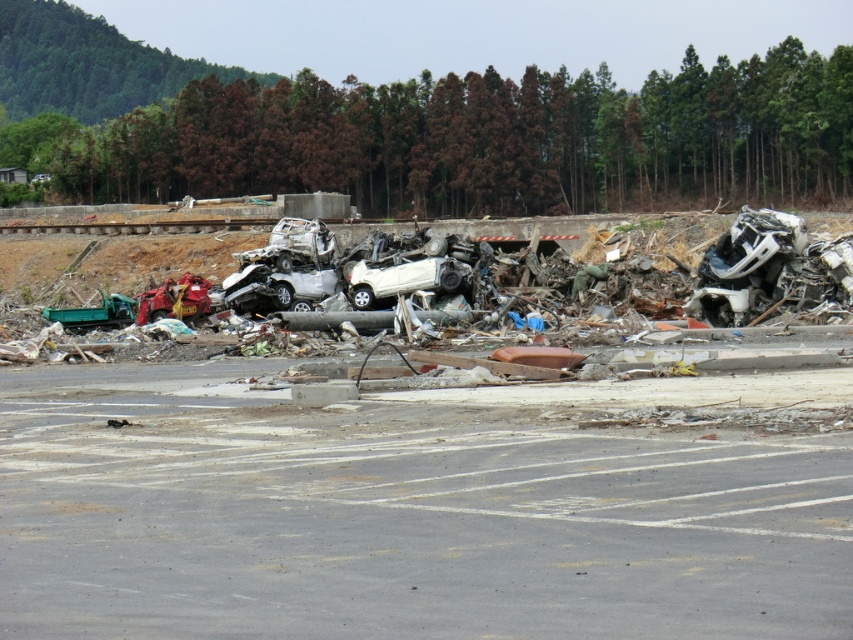
Question: Which object is farther from the camera taking this photo?

Choices:
 (A) gray asphalt parking lot at lower center
 (B) metallic red motorcycle at left

Answer: (B)

Question: Considering the real-world distances, which object is farthest from the rusty metal car at center?

Choices:
 (A) metallic red motorcycle at left
 (B) white plastic car at right
 (C) gray asphalt parking lot at lower center
 (D) white matte car at center

Answer: (C)

Question: Can you confirm if white matte car at center is positioned to the right of metallic red motorcycle at left?

Choices:
 (A) no
 (B) yes

Answer: (B)

Question: Does rusty metal car at center appear over metallic red motorcycle at left?

Choices:
 (A) no
 (B) yes

Answer: (B)

Question: Considering the real-world distances, which object is farthest from the gray asphalt parking lot at lower center?

Choices:
 (A) white matte car at center
 (B) rusty metal car at center
 (C) white plastic car at right
 (D) metallic red motorcycle at left

Answer: (B)

Question: Considering the relative positions of white plastic car at right and white matte car at center in the image provided, where is white plastic car at right located with respect to white matte car at center?

Choices:
 (A) left
 (B) right

Answer: (B)